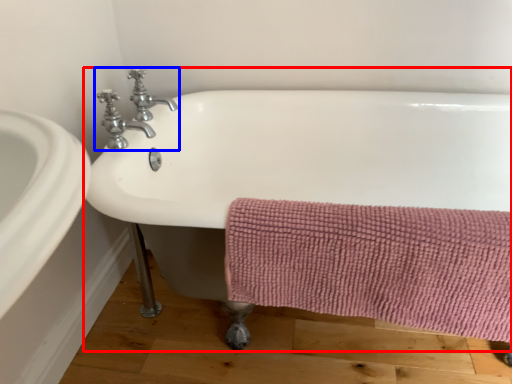
Question: Among these objects, which one is farthest to the camera, bathtub (highlighted by a red box) or tap (highlighted by a blue box)?

Choices:
 (A) bathtub
 (B) tap

Answer: (B)